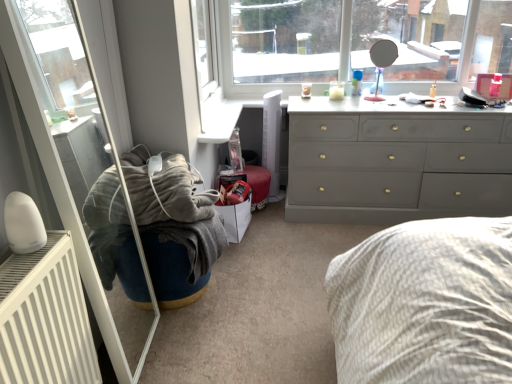
Question: Should I look upward or downward to see dark blue fabric bean bag chair at center?

Choices:
 (A) up
 (B) down

Answer: (B)

Question: Is white glossy radiator at left to the right of white cardboard shoe box at lower center from the viewer's perspective?

Choices:
 (A) no
 (B) yes

Answer: (A)

Question: Can you confirm if white glossy radiator at left is bigger than white cardboard shoe box at lower center?

Choices:
 (A) no
 (B) yes

Answer: (B)

Question: Is there a large distance between white glossy radiator at left and white cardboard shoe box at lower center?

Choices:
 (A) yes
 (B) no

Answer: (B)

Question: Could you tell me if white glossy radiator at left is turned towards white cardboard shoe box at lower center?

Choices:
 (A) no
 (B) yes

Answer: (A)

Question: Is white glossy radiator at left outside white cardboard shoe box at lower center?

Choices:
 (A) no
 (B) yes

Answer: (B)

Question: Are white glossy radiator at left and white cardboard shoe box at lower center making contact?

Choices:
 (A) no
 (B) yes

Answer: (A)

Question: Is white cardboard shoe box at lower center oriented towards white glossy radiator at left?

Choices:
 (A) no
 (B) yes

Answer: (A)

Question: Considering the relative positions of white cardboard shoe box at lower center and white glossy radiator at left in the image provided, is white cardboard shoe box at lower center to the left of white glossy radiator at left from the viewer's perspective?

Choices:
 (A) no
 (B) yes

Answer: (A)

Question: Is the position of white cardboard shoe box at lower center less distant than that of white glossy radiator at left?

Choices:
 (A) yes
 (B) no

Answer: (B)

Question: From the image's perspective, is white cardboard shoe box at lower center under white glossy radiator at left?

Choices:
 (A) no
 (B) yes

Answer: (B)

Question: Does white cardboard shoe box at lower center have a smaller size compared to white glossy radiator at left?

Choices:
 (A) yes
 (B) no

Answer: (A)

Question: Can you confirm if white cardboard shoe box at lower center is wider than white glossy radiator at left?

Choices:
 (A) no
 (B) yes

Answer: (B)

Question: Is dark blue fabric bean bag chair at center to the left of white cardboard shoe box at lower center from the viewer's perspective?

Choices:
 (A) no
 (B) yes

Answer: (B)